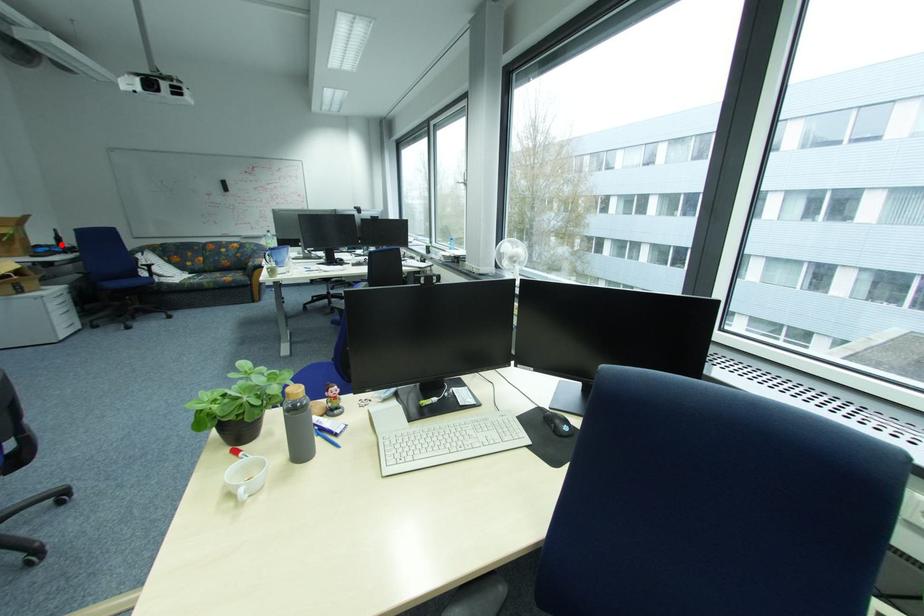
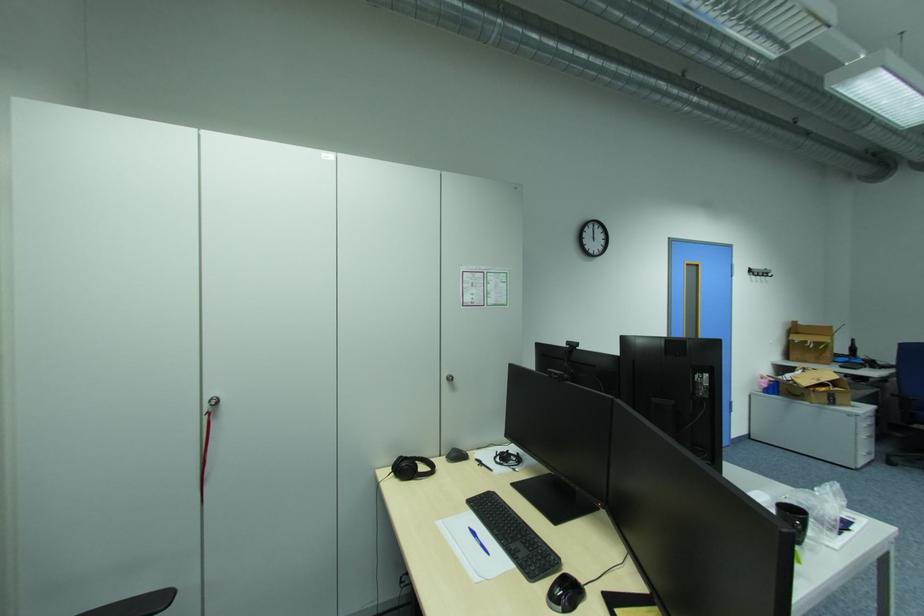
Question: I am providing you with two images of the same scene from different viewpoints. Given a red point in image1, look at the same physical point in image2. Is it:

Choices:
 (A) Closer to the viewpoint
 (B) Farther from the viewpoint

Answer: (A)